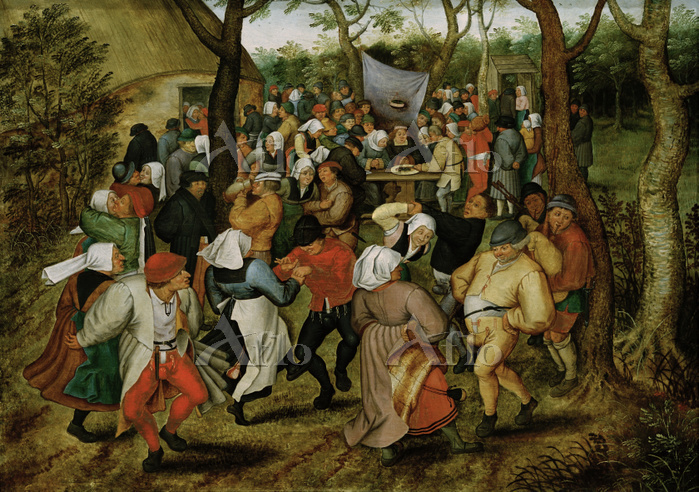
The height and width of the screenshot is (492, 699). Identify the location of blanket. (379, 79).